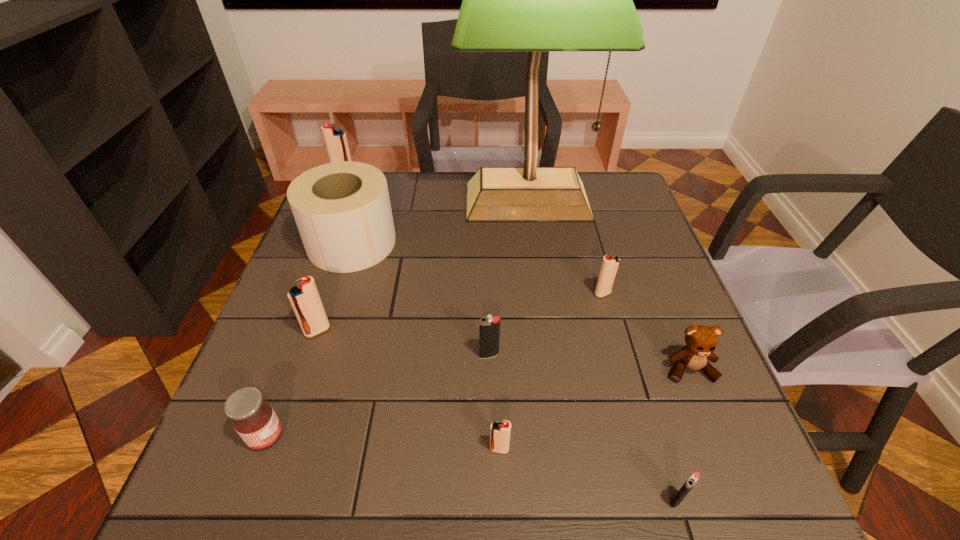
Locate an element on the screen. The height and width of the screenshot is (540, 960). object identified as the closest to the nearest object is located at coordinates (701, 341).

Identify which object is the fifth nearest to the toilet tissue. Please provide its 2D coordinates. Your answer should be formatted as a tuple, i.e. [(x, y)], where the tuple contains the x and y coordinates of a point satisfying the conditions above.

[(254, 419)]

Identify which igniter is the third closest to the farthest igniter. Please provide its 2D coordinates. Your answer should be formatted as a tuple, i.e. [(x, y)], where the tuple contains the x and y coordinates of a point satisfying the conditions above.

[(610, 264)]

Identify which igniter is located as the fifth nearest to the farthest igniter. Please provide its 2D coordinates. Your answer should be formatted as a tuple, i.e. [(x, y)], where the tuple contains the x and y coordinates of a point satisfying the conditions above.

[(693, 479)]

Find the location of a particular element. This screenshot has height=540, width=960. red igniter that is the third closest to the leftmost red igniter is located at coordinates (500, 431).

Where is `red igniter that is the third closest to the jam`? red igniter that is the third closest to the jam is located at coordinates (610, 264).

Locate an element on the screen. The width and height of the screenshot is (960, 540). blank area in the image that satisfies the following two spatial constraints: 1. on the front side of the left black igniter; 2. on the label side of the jam is located at coordinates (491, 436).

Locate an element on the screen. The image size is (960, 540). free space in the image that satisfies the following two spatial constraints: 1. on the front-facing side of the teddy bear; 2. on the label side of the jam is located at coordinates (717, 436).

The image size is (960, 540). I want to click on vacant area that satisfies the following two spatial constraints: 1. on the metallic stand of the fourth farthest object; 2. on the right side of the green table lamp, so click(x=540, y=293).

Identify the location of free region that satisfies the following two spatial constraints: 1. on the front side of the toilet tissue; 2. on the right side of the right black igniter. This screenshot has height=540, width=960. (268, 501).